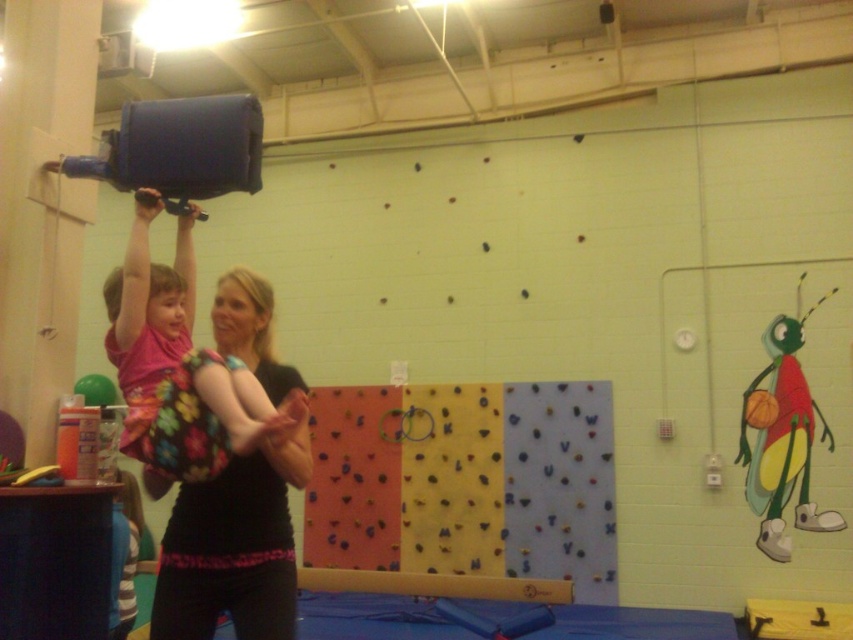
Question: Considering the relative positions of black fabric shirt at center and yellow foam beam at center in the image provided, where is black fabric shirt at center located with respect to yellow foam beam at center?

Choices:
 (A) above
 (B) below

Answer: (A)

Question: Among these points, which one is nearest to the camera?

Choices:
 (A) (231, 320)
 (B) (831, 440)

Answer: (A)

Question: Which object is positioned farthest from the smooth blonde hair at center?

Choices:
 (A) black fabric shirt at center
 (B) cartoonish fabric bug at right

Answer: (B)

Question: Can you confirm if black fabric shirt at center is thinner than floral fabric dress at center?

Choices:
 (A) no
 (B) yes

Answer: (B)

Question: Is cartoonish fabric bug at right to the right of smooth blonde hair at center from the viewer's perspective?

Choices:
 (A) yes
 (B) no

Answer: (A)

Question: Based on their relative distances, which object is farther from the pink fabric head at upper center?

Choices:
 (A) floral fabric dress at center
 (B) cartoonish fabric bug at right
 (C) black fabric shirt at center
 (D) yellow foam beam at center

Answer: (B)